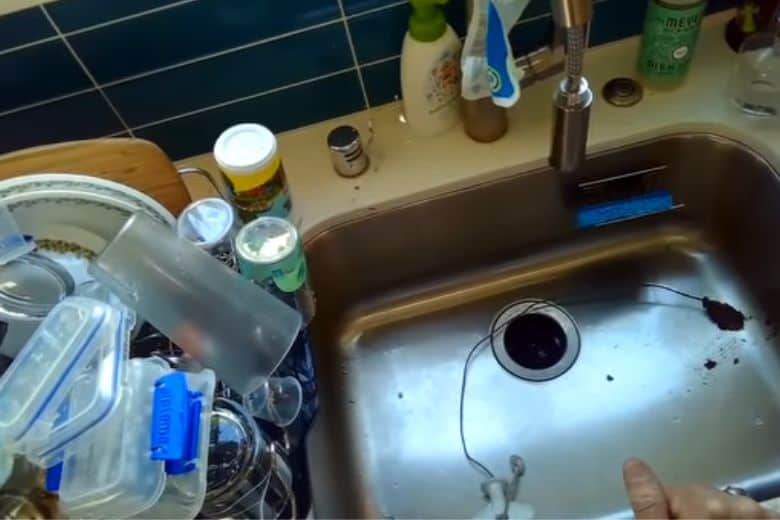
This screenshot has height=520, width=780. Identify the location of plate. (73, 193).